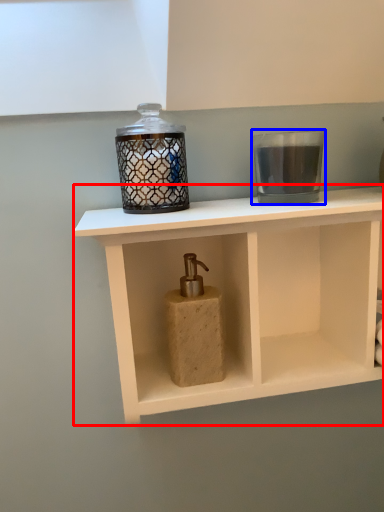
Question: Among these objects, which one is farthest to the camera, shelf (highlighted by a red box) or candle holder (highlighted by a blue box)?

Choices:
 (A) shelf
 (B) candle holder

Answer: (B)